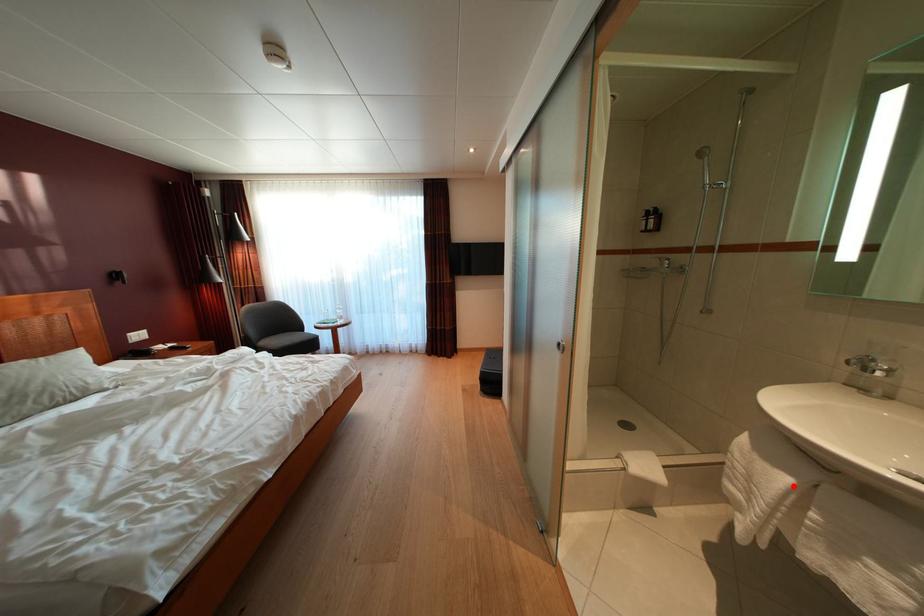
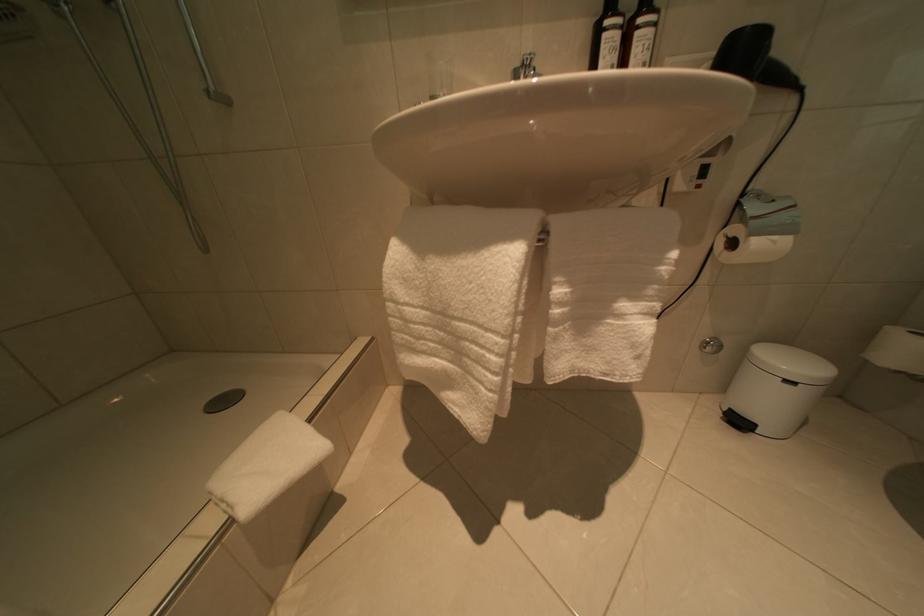
The point at the highlighted location is marked in the first image. Where is the corresponding point in the second image?

(517, 262)